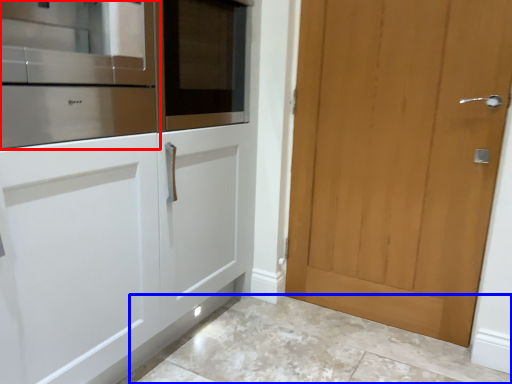
Question: Which object appears closest to the camera in this image, cabinetry (highlighted by a red box) or granite (highlighted by a blue box)?

Choices:
 (A) cabinetry
 (B) granite

Answer: (A)